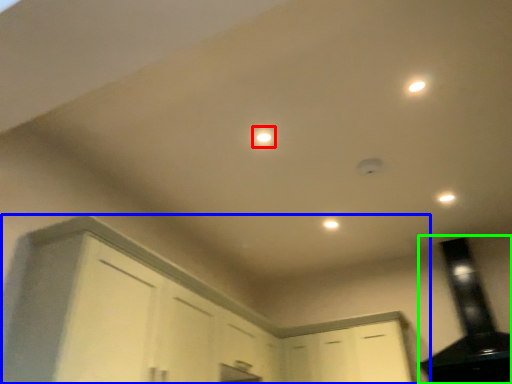
Question: Estimate the real-world distances between objects in this image. Which object is farther from light (highlighted by a red box), cabinetry (highlighted by a blue box) or exhaust hood (highlighted by a green box)?

Choices:
 (A) cabinetry
 (B) exhaust hood

Answer: (B)